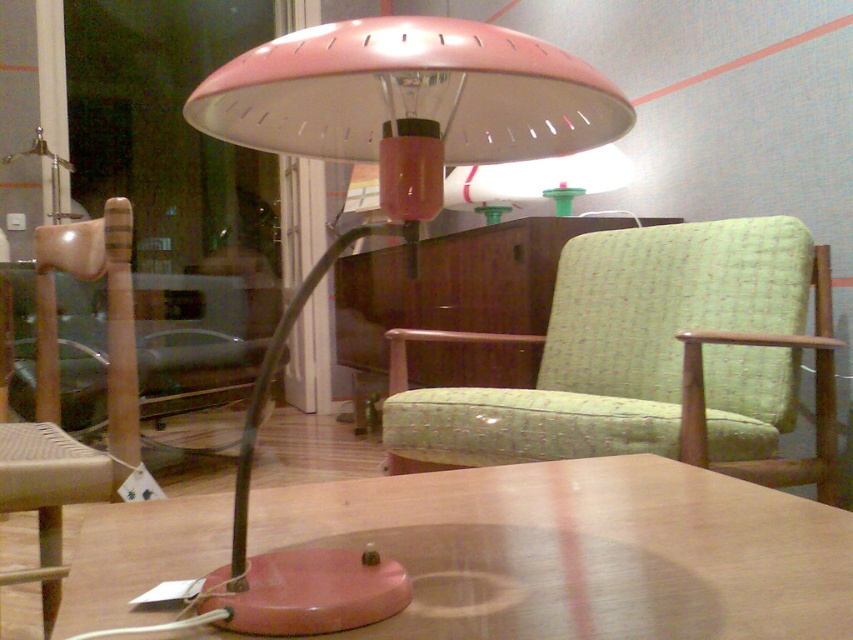
You are positioning a new lamp on the matte pink table at center. According to the image, where exactly should you place the lamp on the table to match its position?

The matte pink table at center is located at point [583,552], so you should place the lamp at that coordinate to match its position.

You are organizing a small event and need to place a 1.2 meter wide banner between the green fabric swivel chair at center and the pink matte table lamp at center. Will the banner fit between them?

The green fabric swivel chair at center is larger in size than the pink matte table lamp at center, but the exact distance between them isn